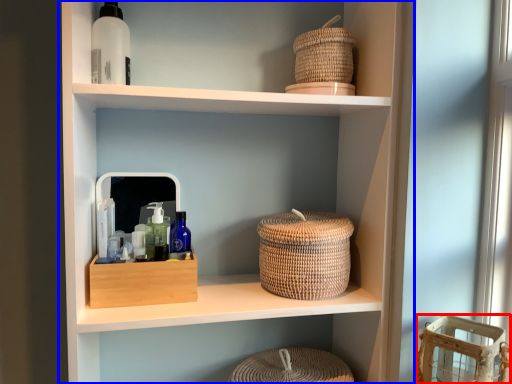
Question: Among these objects, which one is nearest to the camera, basket (highlighted by a red box) or shelf (highlighted by a blue box)?

Choices:
 (A) basket
 (B) shelf

Answer: (A)